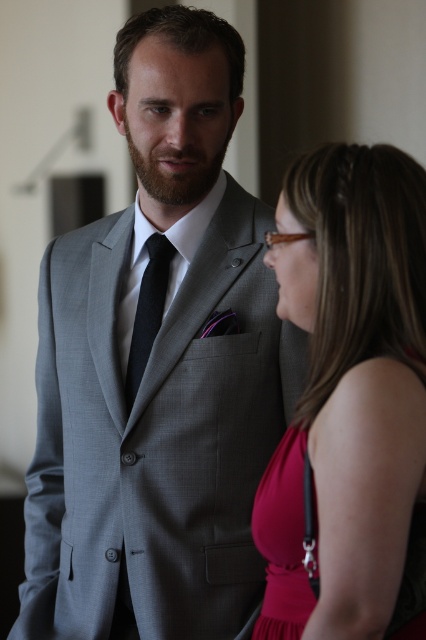
You are a photographer setting up for a portrait. You need to ensure that the matte pink dress at right and the black silk tie at center are both in focus. Given that the camera can only focus on objects within 1 meter of each other in height, will both items be in focus?

The matte pink dress at right is taller than the black silk tie at center, but the exact height difference isn

You are an interior designer analyzing the spatial layout of the scene. The matte gray suit at center is positioned at coordinates point 0.575, 0.373. Can you determine if this placement aligns with the standard ergonomic guidelines for seating arrangements in professional settings?

The matte gray suit at center is located at point (158,368). According to standard ergonomic guidelines, seating should be positioned to allow comfortable interaction between individuals, typically within a range of 1 to 4 feet apart. Without specific measurements, it is challenging to confirm compliance, but the coordinates suggest a central placement which is often recommended for balanced professional interactions.

You are standing in a room where two people are talking. The man is wearing a matte gray suit at center. If you want to approach him without entering his personal space, which direction should you move relative to his position at point 0.575, 0.373?

To approach the man wearing the matte gray suit at center without entering his personal space, you should move towards his position at point (158,368) but maintain a respectful distance.